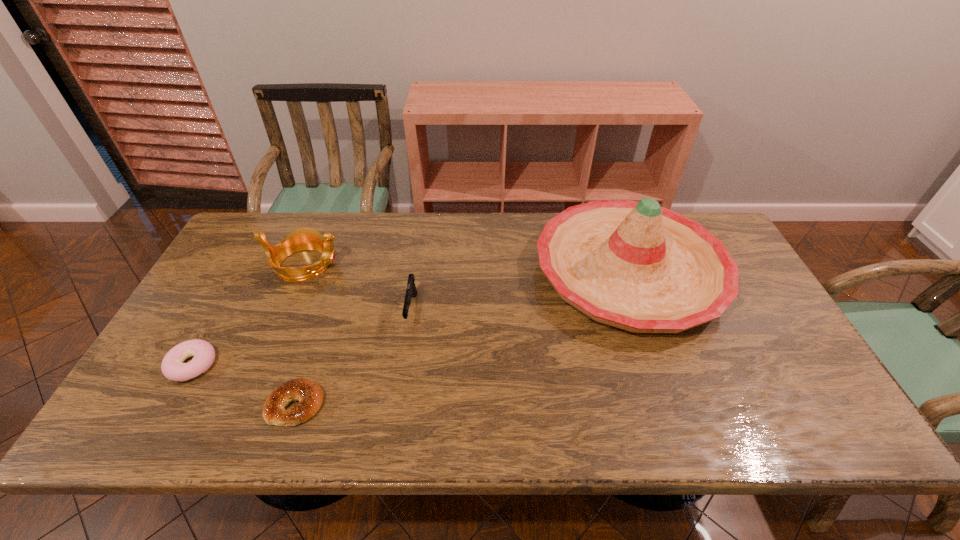
You are a GUI agent. You are given a task and a screenshot of the screen. Output one action in this format:
    pyautogui.click(x=<x>, y=<y>)
    Task: Click on the vacant region at the far edge
    
    Given the screenshot: What is the action you would take?
    pyautogui.click(x=475, y=219)

Locate an element on the screen. free point at the near edge is located at coordinates (324, 438).

Locate an element on the screen. vacant area at the right edge of the desktop is located at coordinates (784, 391).

The image size is (960, 540). In order to click on vacant area at the near left corner of the desktop in this screenshot , I will do `click(156, 410)`.

You are a GUI agent. You are given a task and a screenshot of the screen. Output one action in this format:
    pyautogui.click(x=<x>, y=<y>)
    Task: Click on the free spot between the tallest object and the fourth shortest object
    This screenshot has width=960, height=540.
    Given the screenshot: What is the action you would take?
    pyautogui.click(x=467, y=268)

Where is `empty location between the second tallest object and the bagel`? The width and height of the screenshot is (960, 540). empty location between the second tallest object and the bagel is located at coordinates (300, 335).

The width and height of the screenshot is (960, 540). Identify the location of empty space that is in between the rightmost object and the leftmost object. (411, 318).

I want to click on free point between the tallest object and the second tallest object, so click(467, 268).

What are the coordinates of `vacant area between the doughnut and the gun` in the screenshot? It's located at (301, 338).

Identify the location of vacant space that's between the tallest object and the leftmost object. (411, 318).